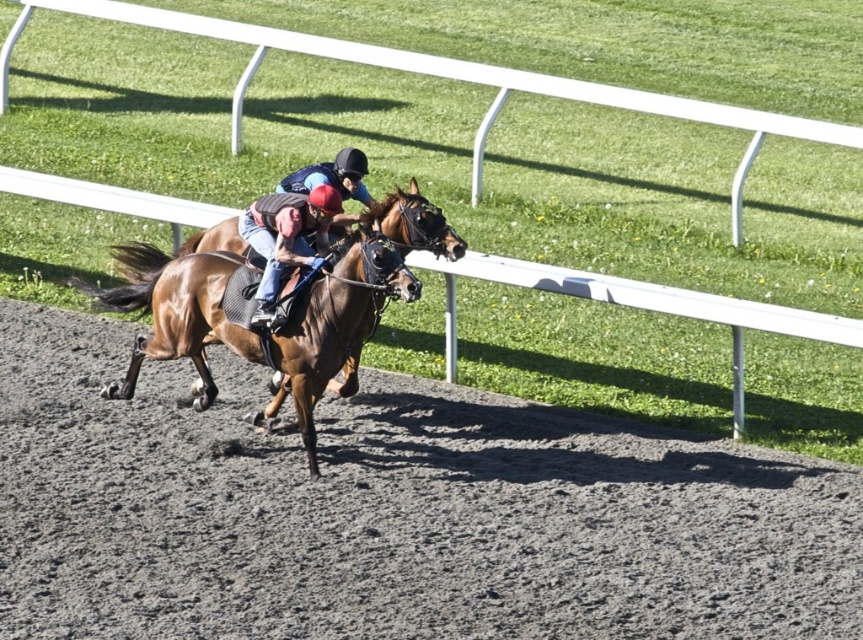
Can you confirm if brown dirt track at center is thinner than leather helmet at center?

No, brown dirt track at center is not thinner than leather helmet at center.

Can you confirm if brown dirt track at center is smaller than leather helmet at center?

No.

Who is more forward, (550,630) or (293,250)?

Point (550,630)

At what (x,y) coordinates should I click in order to perform the action: click on brown dirt track at center. Please return your answer as a coordinate pair (x, y). Looking at the image, I should click on (389, 513).

Does point (24, 193) lie behind point (323, 202)?

Yes, point (24, 193) is farther from viewer.

Does white plastic rail at center come in front of leather helmet at center?

No.

Is point (652, 97) less distant than point (276, 243)?

No, it is not.

Identify the location of white plastic rail at center. (444, 76).

Does brown glossy horse at center have a larger size compared to leather helmet at center?

Indeed, brown glossy horse at center has a larger size compared to leather helmet at center.

Who is positioned more to the left, brown glossy horse at center or leather helmet at center?

From the viewer's perspective, brown glossy horse at center appears more on the left side.

Describe the element at coordinates (253, 326) in the screenshot. I see `brown glossy horse at center` at that location.

I want to click on brown glossy horse at center, so click(253, 326).